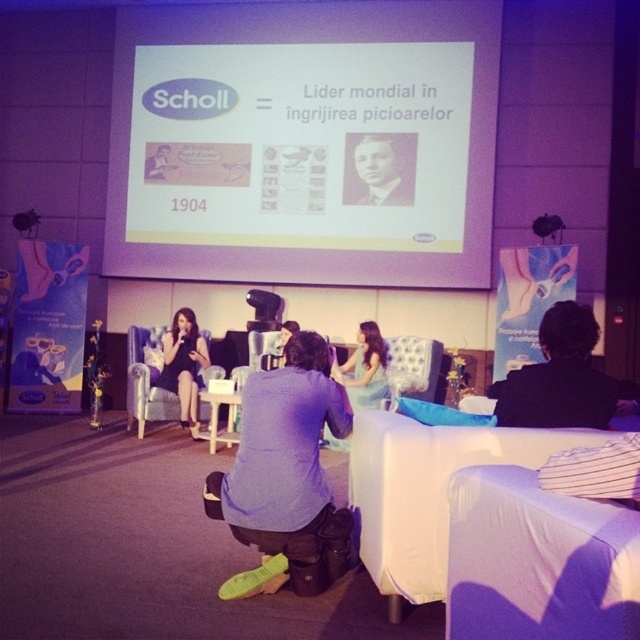
You are an event organizer setting up for a presentation. You need to ensure that the white matte projection screen at center is visible to all attendees. Given that the black and white photograph of man at upper center is part of the stage backdrop, will the screen block the view of the photograph for the audience?

The white matte projection screen at center is in front of the black and white photograph of man at upper center, so it will block the photograph from the audience view.

You are an event organizer who needs to place a 10 cm wide decorative ribbon exactly between the black fabric jacket at center and the black and white photograph of man at upper center. Can you fit the ribbon there without overlapping either object?

The black fabric jacket at center is thinner than the black and white photograph of man at upper center. Since the jacket is thinner, there might be enough space between them to place the 10 cm ribbon without overlapping, but exact placement depends on their exact positions.

You are organizing a fashion show and need to decide which outfit to feature first. Based on the image, which item is bigger in size between the purple fabric shirt at center and the black satin dress at lower left?

The purple fabric shirt at center has a larger size compared to the black satin dress at lower left, so the purple fabric shirt at center should be featured first as it is bigger in size.